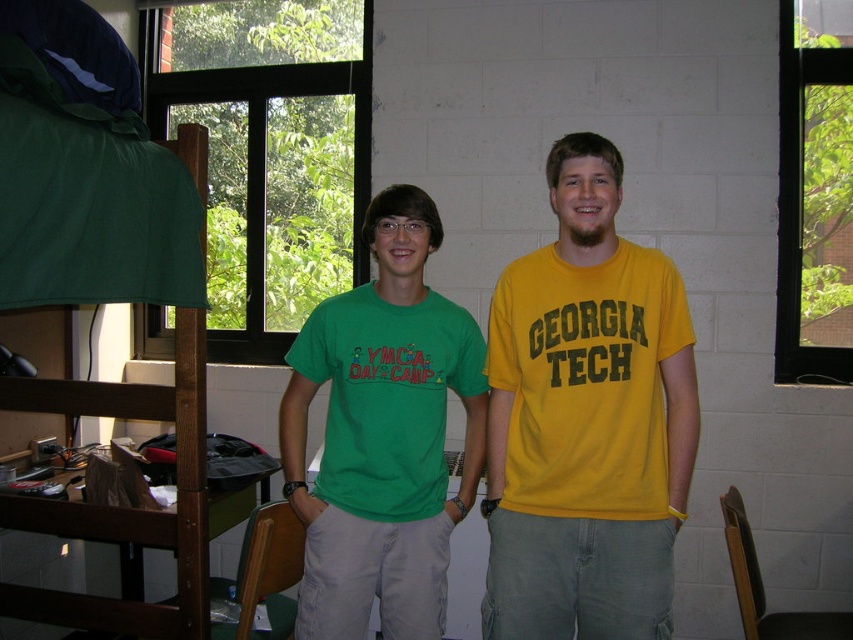
In the scene shown: Is yellow cotton t-shirt at center behind green fabric bunk bed at left?

Yes, yellow cotton t-shirt at center is further from the viewer.

Which of these two, yellow cotton t-shirt at center or green fabric bunk bed at left, stands shorter?

Standing shorter between the two is green fabric bunk bed at left.

This screenshot has height=640, width=853. I want to click on yellow cotton t-shirt at center, so click(585, 420).

Between green matte t-shirt at center and green fabric bunk bed at left, which one is positioned lower?

Positioned lower is green matte t-shirt at center.

From the picture: Does green matte t-shirt at center lie behind green fabric bunk bed at left?

Yes, it is.

Is point (399, 200) positioned after point (106, 35)?

Yes.

The image size is (853, 640). What are the coordinates of `green matte t-shirt at center` in the screenshot? It's located at (381, 435).

Can you confirm if yellow cotton t-shirt at center is smaller than green matte t-shirt at center?

Correct, yellow cotton t-shirt at center occupies less space than green matte t-shirt at center.

Is yellow cotton t-shirt at center below green matte t-shirt at center?

No.

Image resolution: width=853 pixels, height=640 pixels. What do you see at coordinates (585, 420) in the screenshot?
I see `yellow cotton t-shirt at center` at bounding box center [585, 420].

Image resolution: width=853 pixels, height=640 pixels. What are the coordinates of `yellow cotton t-shirt at center` in the screenshot? It's located at (585, 420).